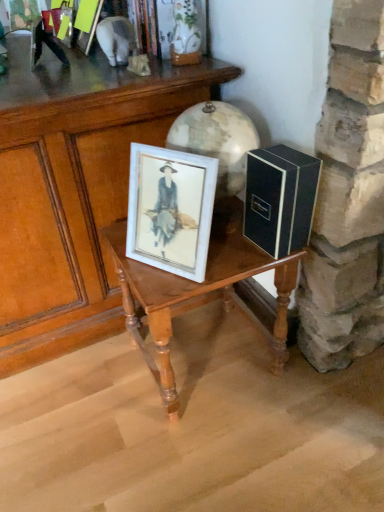
Find the location of a particular element. The height and width of the screenshot is (512, 384). blank area beneath wooden table at center, which ranks as the 2th table in left-to-right order (from a real-world perspective) is located at coordinates (211, 356).